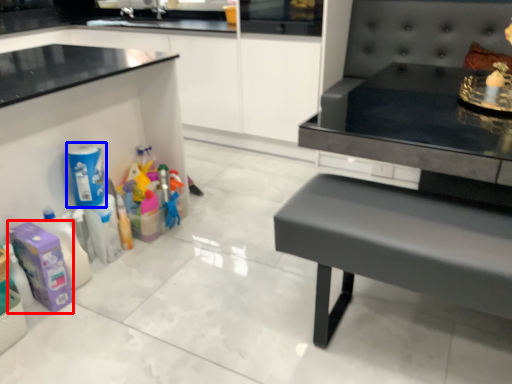
Question: Which of the following is the closest to the observer, cleaning product (highlighted by a red box) or cleaning product (highlighted by a blue box)?

Choices:
 (A) cleaning product
 (B) cleaning product

Answer: (A)